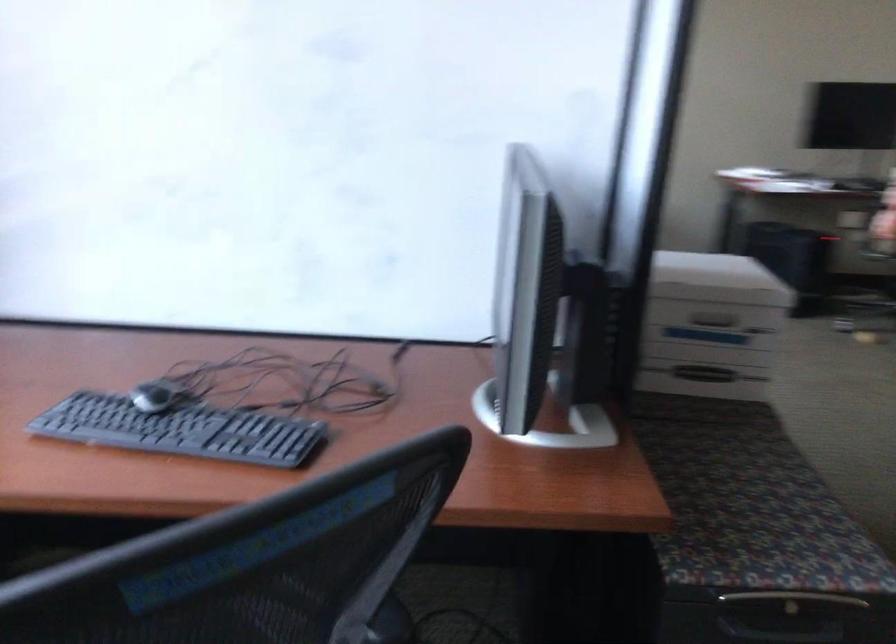
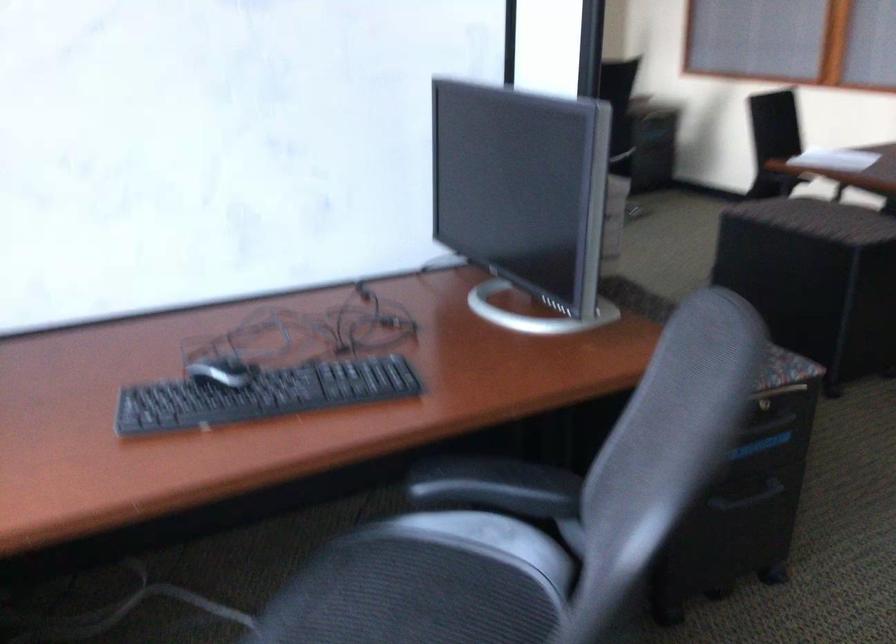
Question: Based on the continuous images, in which direction is the camera rotating? Reply with the corresponding letter.

Choices:
 (A) Left
 (B) Right
 (C) Up
 (D) Down

Answer: (B)